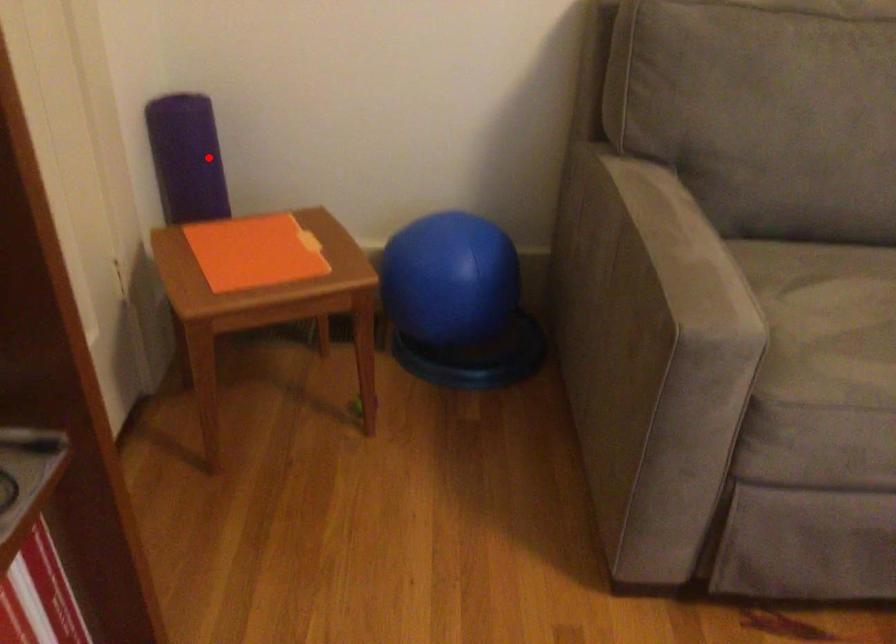
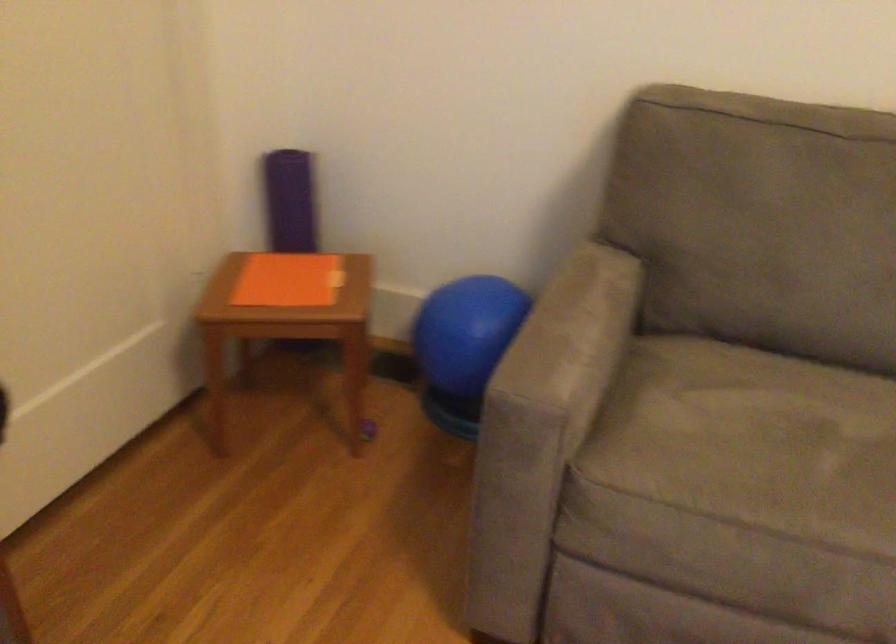
Question: I am providing you with two images of the same scene from different viewpoints. In image1, a red point is highlighted. Considering the same 3D point in image2, which of the following is correct?

Choices:
 (A) It is closer
 (B) It is farther

Answer: (B)